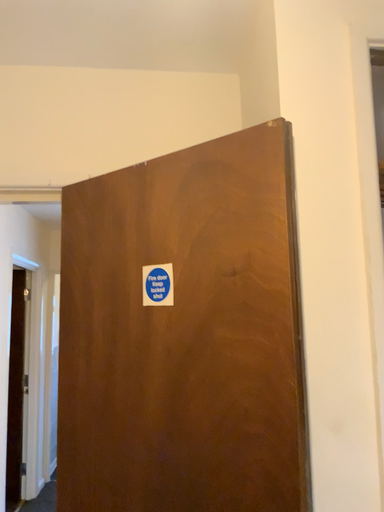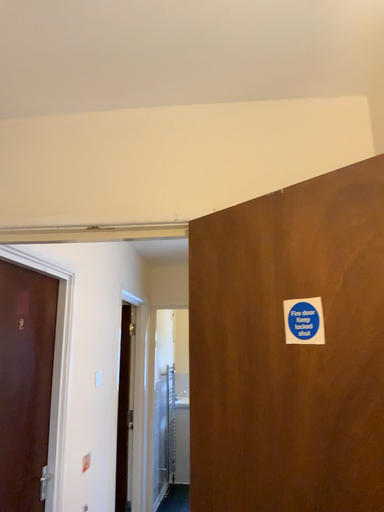
Question: Which way did the camera rotate in the video?

Choices:
 (A) rotated left
 (B) rotated right

Answer: (A)